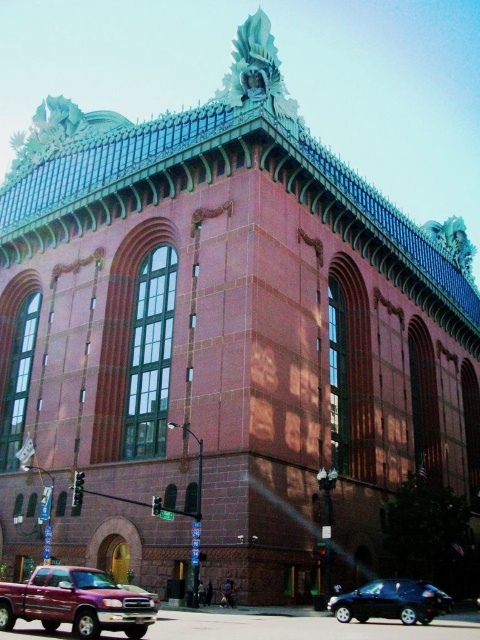
From the picture: Is metallic maroon pickup truck at lower left wider than shiny black car at lower right?

Yes, metallic maroon pickup truck at lower left is wider than shiny black car at lower right.

Consider the image. Which is more to the right, metallic maroon pickup truck at lower left or shiny black car at lower right?

Positioned to the right is shiny black car at lower right.

Is point (148, 600) positioned behind point (411, 612)?

No.

Locate an element on the screen. The width and height of the screenshot is (480, 640). metallic maroon pickup truck at lower left is located at coordinates (76, 602).